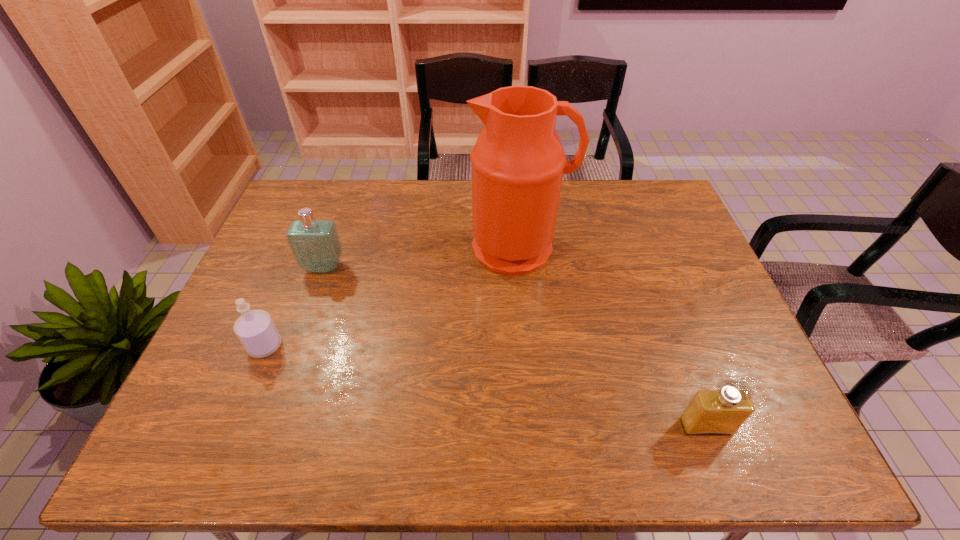
Identify the location of water jug. click(518, 162).

Locate an element on the screen. the second object from right to left is located at coordinates (518, 162).

At what (x,y) coordinates should I click in order to perform the action: click on the farthest perfume. Please return your answer as a coordinate pair (x, y). The width and height of the screenshot is (960, 540). Looking at the image, I should click on (315, 244).

At what (x,y) coordinates should I click in order to perform the action: click on the second tallest object. Please return your answer as a coordinate pair (x, y). Looking at the image, I should click on (315, 244).

Identify the location of the second nearest perfume. (255, 329).

I want to click on the nearest object, so click(722, 412).

This screenshot has height=540, width=960. I want to click on the rightmost perfume, so click(x=722, y=412).

You are a GUI agent. You are given a task and a screenshot of the screen. Output one action in this format:
    pyautogui.click(x=<x>, y=<y>)
    Task: Click on the blank space located from the spout of the water jug
    Image resolution: width=960 pixels, height=540 pixels.
    Given the screenshot: What is the action you would take?
    pyautogui.click(x=524, y=303)

Where is `free space located on the front label of the tallest perfume`? This screenshot has height=540, width=960. free space located on the front label of the tallest perfume is located at coordinates (302, 328).

The width and height of the screenshot is (960, 540). In order to click on free region located on the right of the second nearest object in this screenshot , I will do `click(424, 346)`.